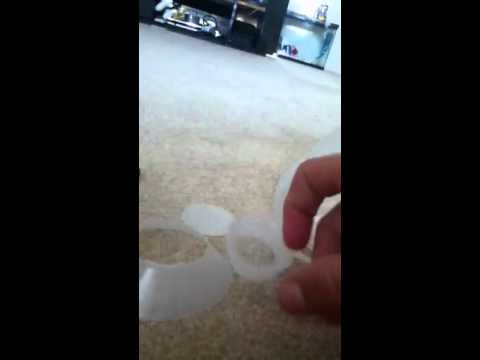
The height and width of the screenshot is (360, 480). In order to click on brownish floor in this screenshot , I will do `click(237, 171)`.